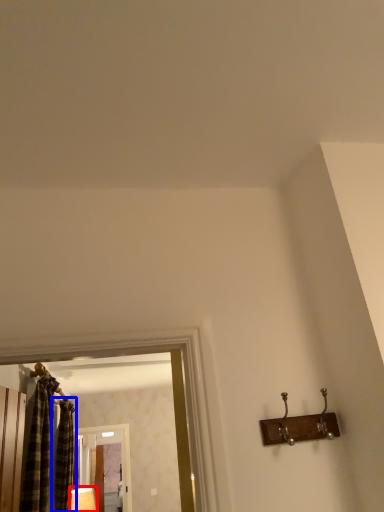
Question: Which of the following is the closest to the observer, lamp (highlighted by a red box) or shower curtain (highlighted by a blue box)?

Choices:
 (A) lamp
 (B) shower curtain

Answer: (B)